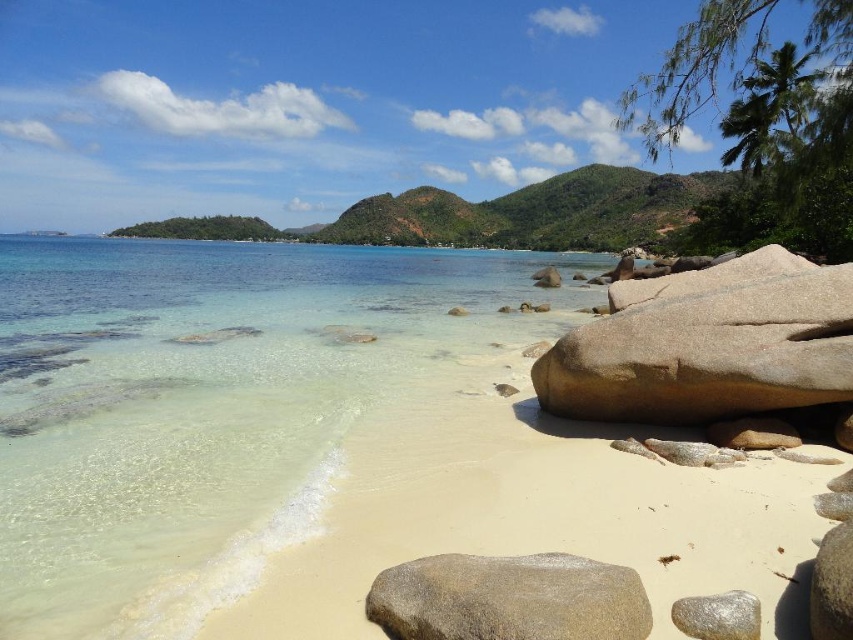
Question: Is clear water at beach center thinner than smooth brown rock at lower right?

Choices:
 (A) no
 (B) yes

Answer: (A)

Question: Which object is positioned closest to the smooth brown rock at lower right?

Choices:
 (A) brown polished rock at center-right
 (B) gray polished rock at lower center

Answer: (B)

Question: Considering the relative positions of clear water at beach center and smooth brown rock at lower right in the image provided, where is clear water at beach center located with respect to smooth brown rock at lower right?

Choices:
 (A) above
 (B) below

Answer: (A)

Question: Which object is closer to the camera taking this photo?

Choices:
 (A) silver metallic rock at lower right
 (B) smooth brown rock at lower right
 (C) gray polished rock at lower center
 (D) clear water at beach center

Answer: (B)

Question: Which point is closer to the camera?

Choices:
 (A) (848, 532)
 (B) (109, 416)

Answer: (A)

Question: Does clear water at beach center appear over brown polished rock at center-right?

Choices:
 (A) yes
 (B) no

Answer: (A)